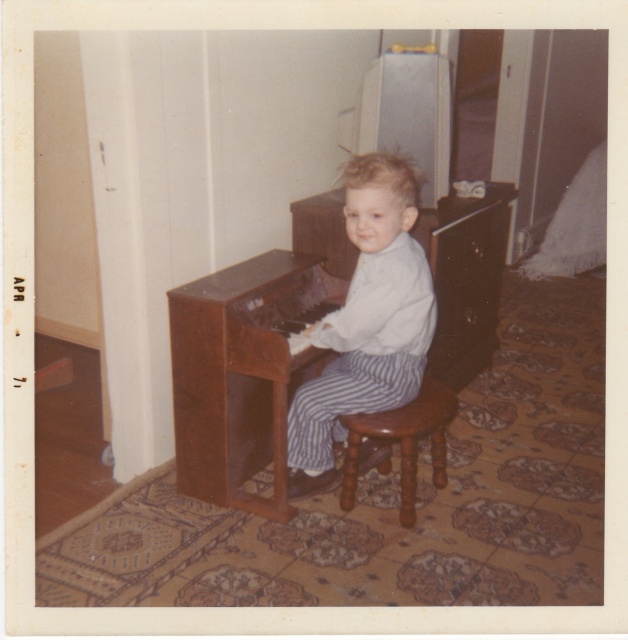
Question: Can you confirm if white striped pants at center is positioned above brown wooden stool at center?

Choices:
 (A) yes
 (B) no

Answer: (A)

Question: Estimate the real-world distances between objects in this image. Which object is farther from the wooden piano at center?

Choices:
 (A) brown wooden stool at center
 (B) white striped pants at center

Answer: (A)

Question: Which point is closer to the camera taking this photo?

Choices:
 (A) (357, 193)
 (B) (414, 412)
 (C) (244, 348)

Answer: (A)

Question: Which point is closer to the camera?

Choices:
 (A) (352, 202)
 (B) (401, 492)
 (C) (293, 307)

Answer: (A)

Question: In this image, where is white striped pants at center located relative to brown wooden stool at center?

Choices:
 (A) above
 (B) below

Answer: (A)

Question: Is wooden piano at center to the left of brown wooden stool at center from the viewer's perspective?

Choices:
 (A) yes
 (B) no

Answer: (A)